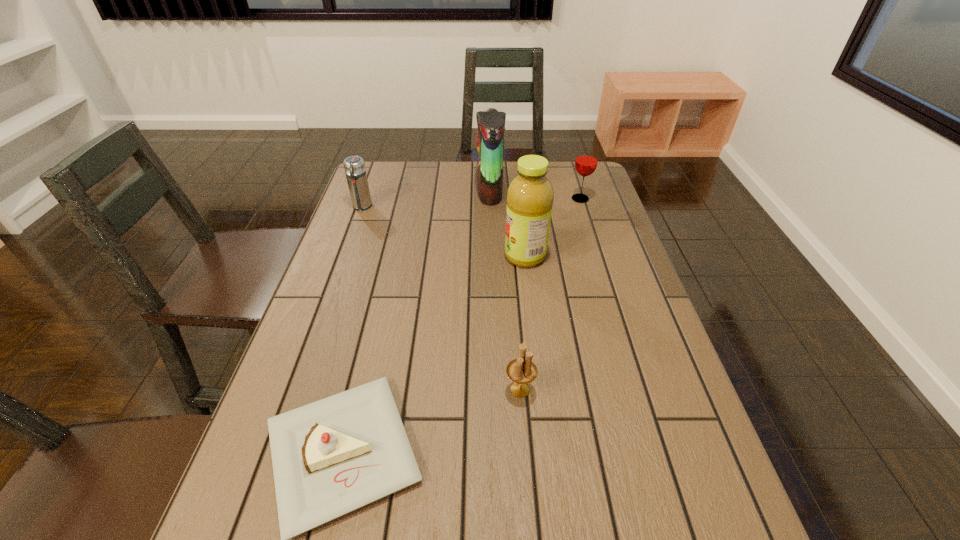
This screenshot has width=960, height=540. What are the coordinates of `free space that satisfies the following two spatial constraints: 1. at the face of the parrot; 2. on the right side of the candle holder` in the screenshot? It's located at (495, 390).

Locate an element on the screen. This screenshot has width=960, height=540. vacant space that satisfies the following two spatial constraints: 1. on the back side of the candle holder; 2. on the left side of the glass is located at coordinates 505,199.

This screenshot has height=540, width=960. I want to click on vacant space that satisfies the following two spatial constraints: 1. at the face of the parrot; 2. on the right side of the candle holder, so click(495, 390).

I want to click on vacant region that satisfies the following two spatial constraints: 1. with a handle on the side of the thermos bottle; 2. on the right side of the candle holder, so point(296,390).